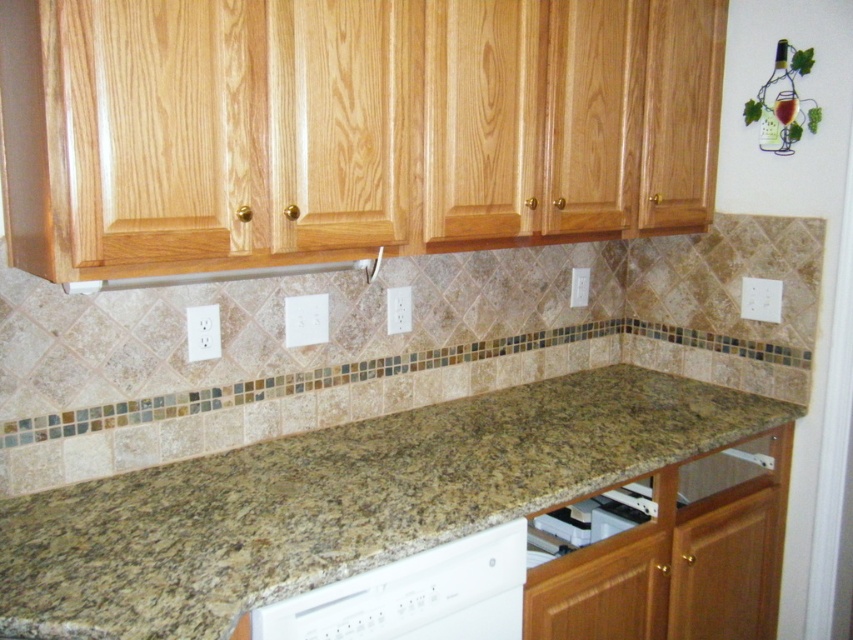
You are a kitchen designer trying to decide between two dishwasher models for a client. The client has a limited space in their kitchen. Which dishwasher, the white matte dishwasher at lower center or the white plastic dishwasher at lower center, would you recommend to fit better in the space?

The white plastic dishwasher at lower center is smaller, so it would fit better in the limited space.

You are a kitchen designer working on a renovation project. You need to place a new appliance that requires a minimum of 1.2 meters in height. Looking at the granite at center and the white plastic dishwasher at lower center, which one meets the height requirement?

The granite at center is taller than the white plastic dishwasher at lower center, so the granite at center meets the height requirement of 1.2 meters.

You are a kitchen designer planning to place a new appliance that is 1.2 meters wide. You have two options for placement areas in the kitchen scene described. The first option is the space where the granite at center is located, and the second is where the white matte dishwasher at lower center is situated. Based on the available space, which location would be more suitable for the appliance?

The granite at center is wider than the white matte dishwasher at lower center, so the space where the granite at center is located would be more suitable for placing the 1.2 meters wide appliance as it offers a wider area.